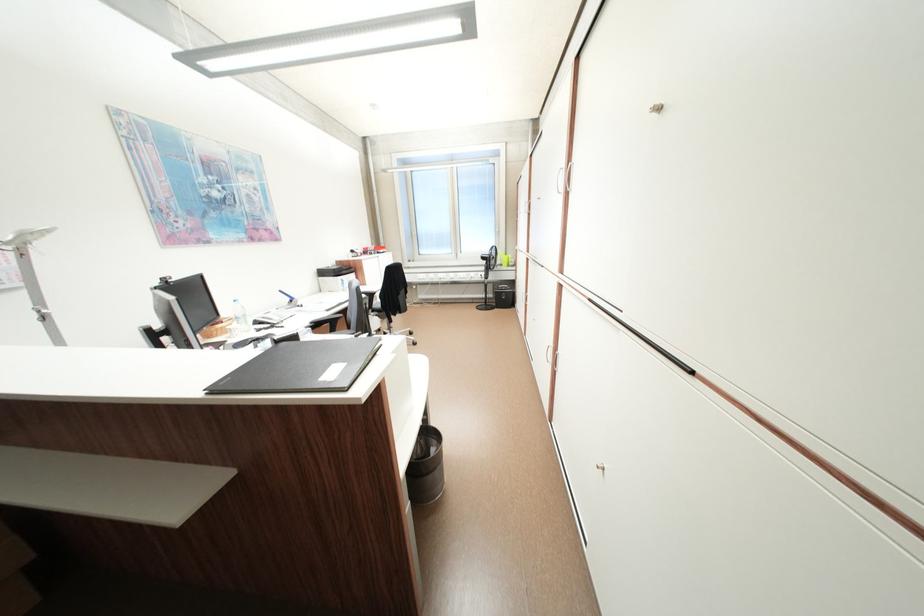
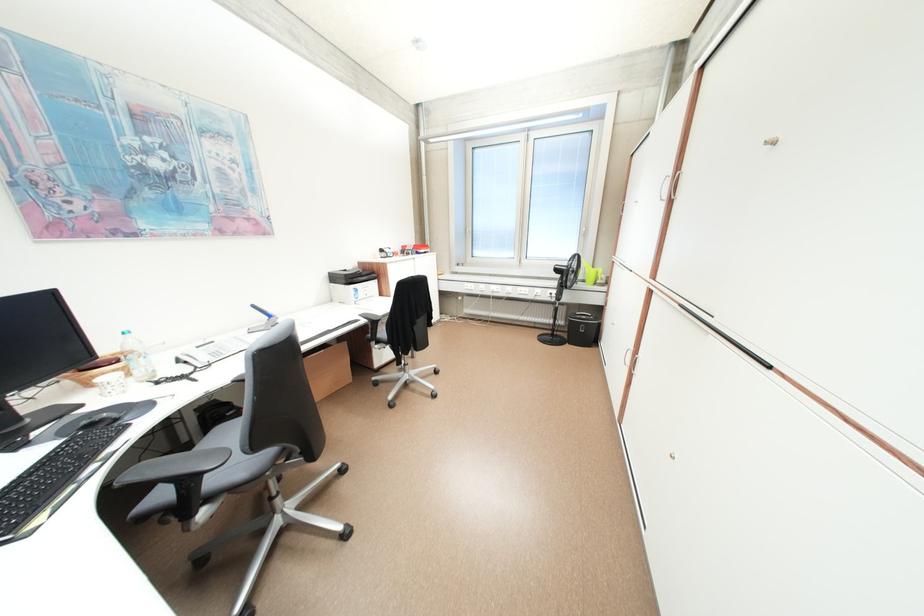
Where in the second image is the point corresponding to [475,274] from the first image?

(537, 290)